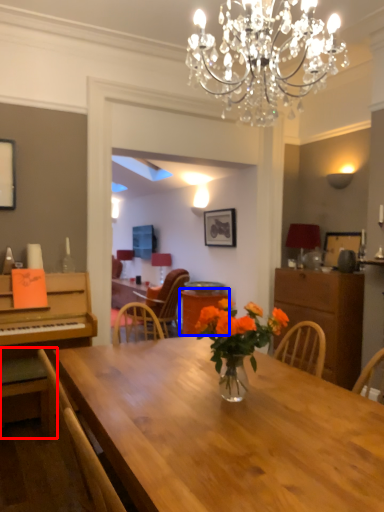
Question: Which object appears closest to the camera in this image, chair (highlighted by a red box) or table (highlighted by a blue box)?

Choices:
 (A) chair
 (B) table

Answer: (A)